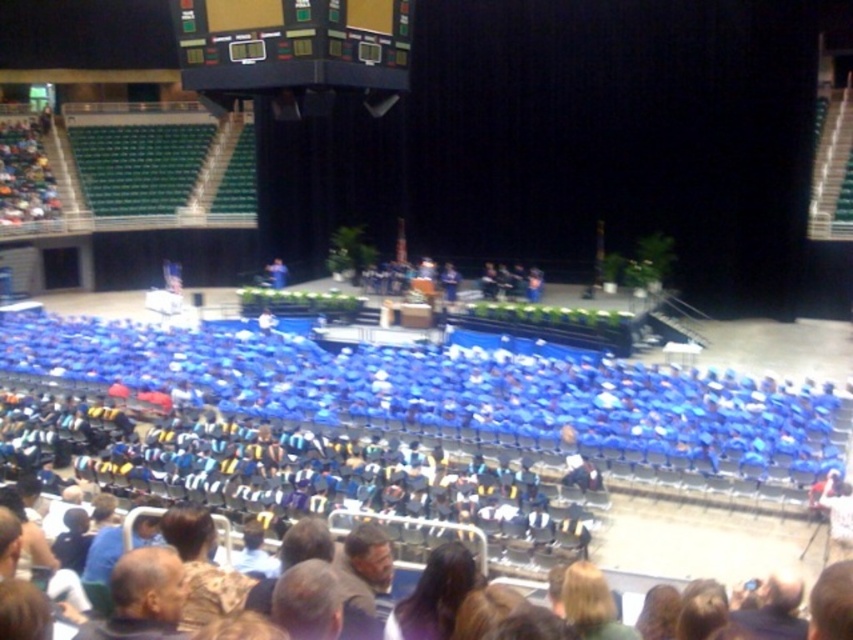
Based on the photo, you are standing in the audience at the graduation ceremony. You want to locate the black glossy scoreboard at upper center. Where should you look?

You should look at point (292,44) to locate the black glossy scoreboard at upper center.

You are a photographer standing in the audience and want to take a photo of the black glossy scoreboard at upper center without the gray hair at lower left being in the frame. Which direction should you move to ensure the scoreboard is visible without the gray hair?

The black glossy scoreboard at upper center is above the gray hair at lower left. To avoid the gray hair at lower left in the frame, you should move upwards or adjust your angle to focus on the scoreboard above it.

Consider the image. You are a photographer at the graduation ceremony. You need to take a photo that includes both the black glossy scoreboard at upper center and the gray hair at lower left. Based on their positions, which object should be placed on the right side of the photo?

The gray hair at lower left should be placed on the right side of the photo because the black glossy scoreboard at upper center is to the left of the gray hair at lower left.